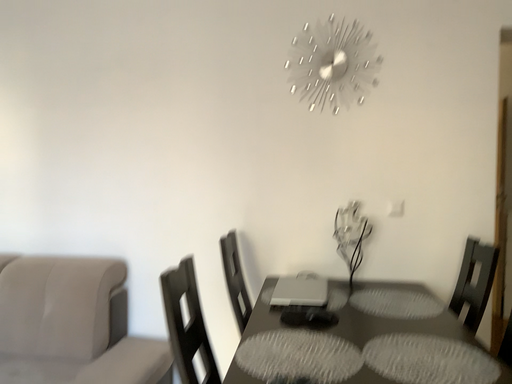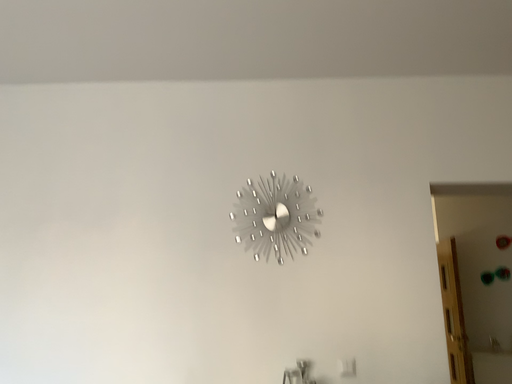
Question: Which way did the camera rotate in the video?

Choices:
 (A) rotated downward
 (B) rotated upward

Answer: (B)